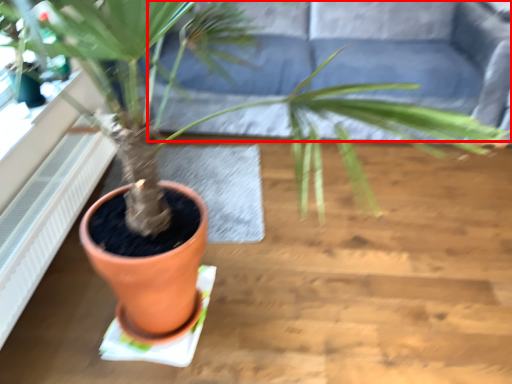
Question: Observing the image, what is the correct spatial positioning of couch (annotated by the red box) in reference to radiator?

Choices:
 (A) right
 (B) left

Answer: (A)